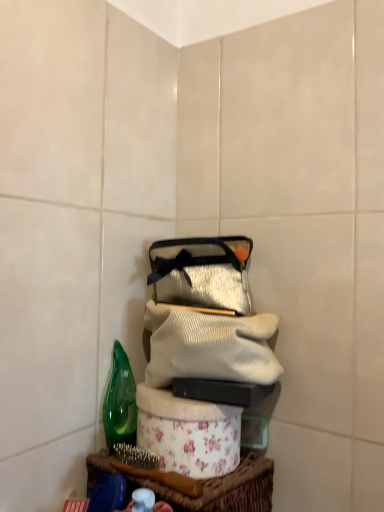
Question: Is green glass bottle at left directly adjacent to white ribbed sweater at center?

Choices:
 (A) yes
 (B) no

Answer: (B)

Question: Does green glass bottle at left have a larger size compared to white ribbed sweater at center?

Choices:
 (A) no
 (B) yes

Answer: (A)

Question: Does green glass bottle at left lie behind white ribbed sweater at center?

Choices:
 (A) yes
 (B) no

Answer: (A)

Question: From the image's perspective, would you say green glass bottle at left is positioned over white ribbed sweater at center?

Choices:
 (A) yes
 (B) no

Answer: (B)

Question: Considering the relative positions of green glass bottle at left and white ribbed sweater at center in the image provided, is green glass bottle at left to the left of white ribbed sweater at center from the viewer's perspective?

Choices:
 (A) yes
 (B) no

Answer: (A)

Question: Considering the relative sizes of green glass bottle at left and white ribbed sweater at center in the image provided, is green glass bottle at left thinner than white ribbed sweater at center?

Choices:
 (A) yes
 (B) no

Answer: (A)

Question: From a real-world perspective, is white ribbed sweater at center physically above green glass bottle at left?

Choices:
 (A) yes
 (B) no

Answer: (A)

Question: From a real-world perspective, does white ribbed sweater at center sit lower than green glass bottle at left?

Choices:
 (A) no
 (B) yes

Answer: (A)

Question: Can you confirm if white ribbed sweater at center is smaller than green glass bottle at left?

Choices:
 (A) yes
 (B) no

Answer: (B)

Question: Can we say white ribbed sweater at center lies outside green glass bottle at left?

Choices:
 (A) no
 (B) yes

Answer: (B)

Question: From the image's perspective, is white ribbed sweater at center located above green glass bottle at left?

Choices:
 (A) no
 (B) yes

Answer: (B)

Question: Can you confirm if white ribbed sweater at center is positioned to the left of green glass bottle at left?

Choices:
 (A) no
 (B) yes

Answer: (A)

Question: From the image's perspective, is white ribbed sweater at center over shiny silver pouch at center?

Choices:
 (A) no
 (B) yes

Answer: (A)